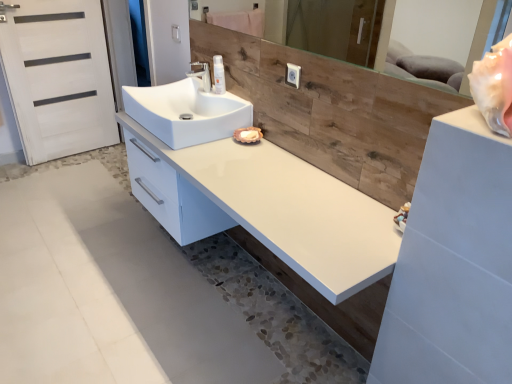
Question: From a real-world perspective, is white glossy spray can at center above or below white matte door at left?

Choices:
 (A) below
 (B) above

Answer: (B)

Question: Is white glossy spray can at center bigger or smaller than white matte door at left?

Choices:
 (A) big
 (B) small

Answer: (B)

Question: Based on their relative distances, which object is farther from the white glossy counter at center?

Choices:
 (A) white glossy faucet at center
 (B) white glossy sink at center
 (C) wooden mirror at upper center
 (D) white matte door at left
 (E) white glossy spray can at center

Answer: (C)

Question: Which of these objects is positioned farthest from the white glossy faucet at center?

Choices:
 (A) white glossy spray can at center
 (B) white glossy counter at center
 (C) wooden mirror at upper center
 (D) white matte door at left
 (E) white glossy sink at center

Answer: (C)